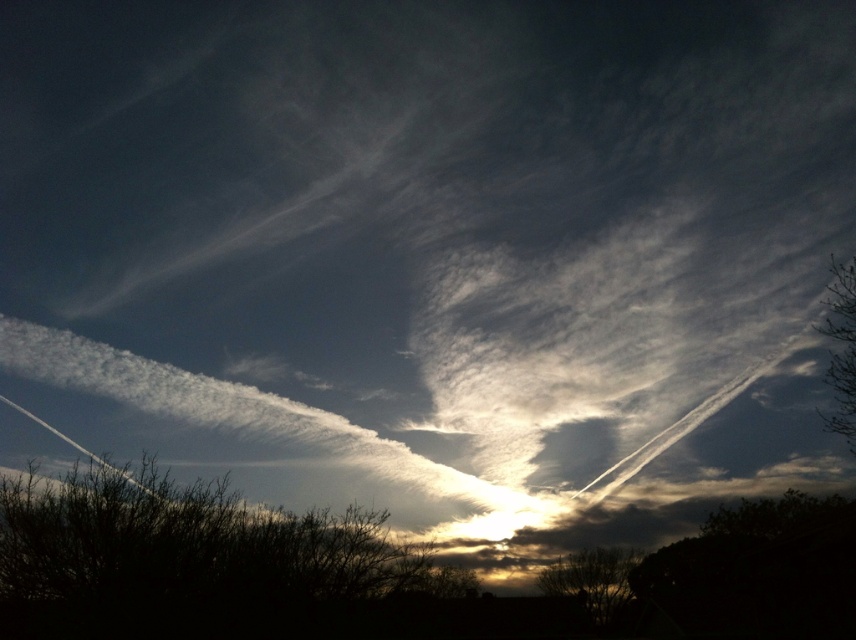
You are standing in a field looking at the dramatic sky scene with the two points marked in the image. Which point, point (288, 609) or point (625, 554), is closer to you?

Point (288, 609) is closer to the viewer than point (625, 554).

Based on the scene description, which tree is taller? The silhouette leafless tree at lower center or the green leafy tree at upper right?

The green leafy tree at upper right is taller than the silhouette leafless tree at lower center.

You are an artist trying to draw this scene. You want to ensure the silhouette leafless tree at lower center and the green leafy tree at upper right are proportionally accurate. Which tree should you draw larger?

The green leafy tree at upper right should be drawn larger because the silhouette leafless tree at lower center is smaller than it.